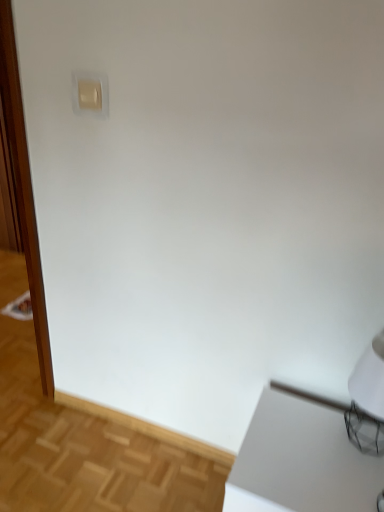
Question: Considering the relative sizes of white glossy screen door at left and beige plastic light switch at upper left in the image provided, is white glossy screen door at left taller than beige plastic light switch at upper left?

Choices:
 (A) no
 (B) yes

Answer: (B)

Question: Considering the relative sizes of white glossy screen door at left and beige plastic light switch at upper left in the image provided, is white glossy screen door at left wider than beige plastic light switch at upper left?

Choices:
 (A) no
 (B) yes

Answer: (B)

Question: Is white glossy screen door at left completely or partially outside of beige plastic light switch at upper left?

Choices:
 (A) no
 (B) yes

Answer: (B)

Question: Is white glossy screen door at left thinner than beige plastic light switch at upper left?

Choices:
 (A) yes
 (B) no

Answer: (B)

Question: Is white glossy screen door at left in front of beige plastic light switch at upper left?

Choices:
 (A) no
 (B) yes

Answer: (A)

Question: From a real-world perspective, is white glossy table at lower right physically located above or below white matte table lamp at lower right?

Choices:
 (A) above
 (B) below

Answer: (B)

Question: In terms of height, does white glossy table at lower right look taller or shorter compared to white matte table lamp at lower right?

Choices:
 (A) short
 (B) tall

Answer: (B)

Question: Is white glossy table at lower right spatially inside white matte table lamp at lower right, or outside of it?

Choices:
 (A) inside
 (B) outside

Answer: (B)

Question: Considering the relative positions of white glossy table at lower right and white matte table lamp at lower right in the image provided, is white glossy table at lower right to the left or to the right of white matte table lamp at lower right?

Choices:
 (A) right
 (B) left

Answer: (B)

Question: In terms of height, does white glossy screen door at left look taller or shorter compared to white matte table lamp at lower right?

Choices:
 (A) short
 (B) tall

Answer: (B)

Question: Does point (14, 65) appear closer or farther from the camera than point (354, 380)?

Choices:
 (A) closer
 (B) farther

Answer: (B)

Question: Do you think white glossy screen door at left is within white matte table lamp at lower right, or outside of it?

Choices:
 (A) inside
 (B) outside

Answer: (B)

Question: Would you say white glossy screen door at left is to the left or to the right of white matte table lamp at lower right in the picture?

Choices:
 (A) right
 (B) left

Answer: (B)

Question: Is point (357, 366) closer or farther from the camera than point (31, 205)?

Choices:
 (A) farther
 (B) closer

Answer: (B)

Question: From a real-world perspective, is white matte table lamp at lower right above or below white glossy screen door at left?

Choices:
 (A) below
 (B) above

Answer: (A)